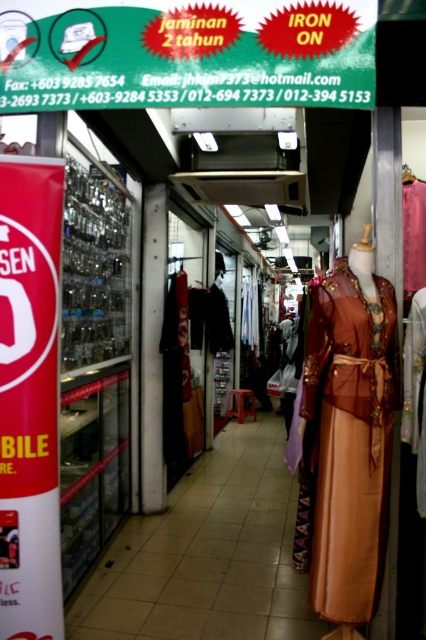
You are a customer in the retail shop and want to reach the matte brown dress at right. However, there is a red glossy iron at upper center blocking your path. Can you walk directly to the dress without moving the iron?

The red glossy iron at upper center is located above the matte brown dress at right, so it does not block the path. You can walk directly to the matte brown dress at right without moving the iron.

You are a customer in the retail shop and want to locate the red glossy iron at upper center. According to the shop layout, where should you look?

The red glossy iron at upper center is located at point (186,52) in the shop layout.

What is the object located at point (186, 52) in the image?

The point (186, 52) marks the red glossy iron at upper center.